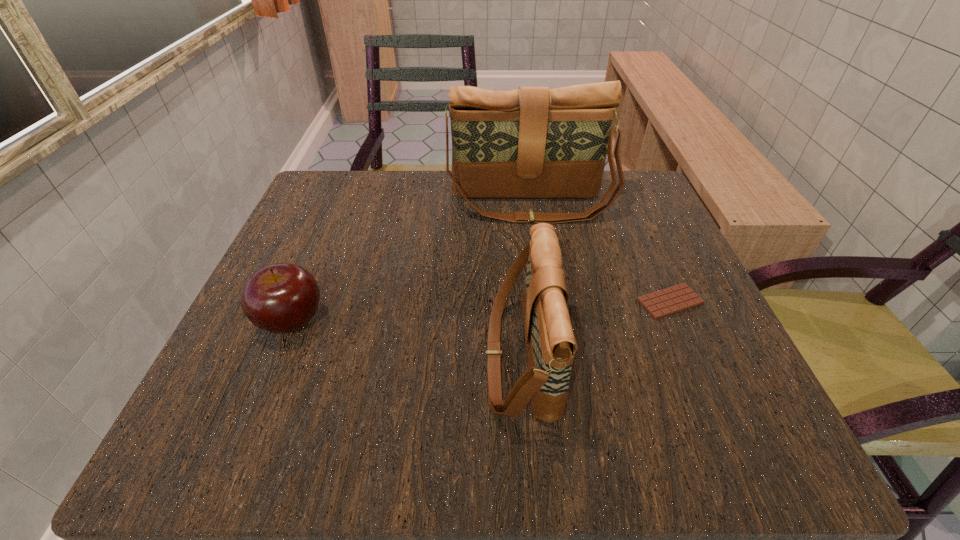
Identify the location of the farther shoulder bag. (532, 142).

Find the location of a particular element. The image size is (960, 540). the taller shoulder bag is located at coordinates (532, 142).

I want to click on the second tallest object, so click(550, 343).

Locate an element on the screen. The image size is (960, 540). the nearer shoulder bag is located at coordinates (550, 343).

Locate an element on the screen. the third tallest object is located at coordinates (280, 298).

In order to click on apple in this screenshot , I will do `click(280, 298)`.

At what (x,y) coordinates should I click in order to perform the action: click on the shortest object. Please return your answer as a coordinate pair (x, y). The width and height of the screenshot is (960, 540). Looking at the image, I should click on (680, 297).

Where is `free space located on the front-facing side of the taller shoulder bag`? free space located on the front-facing side of the taller shoulder bag is located at coordinates (542, 286).

What are the coordinates of `vacant space positioned 0.290m on the front-facing side of the nearer shoulder bag` in the screenshot? It's located at (292, 358).

Find the location of `vacant region located on the front-facing side of the nearer shoulder bag`. vacant region located on the front-facing side of the nearer shoulder bag is located at coordinates (366, 358).